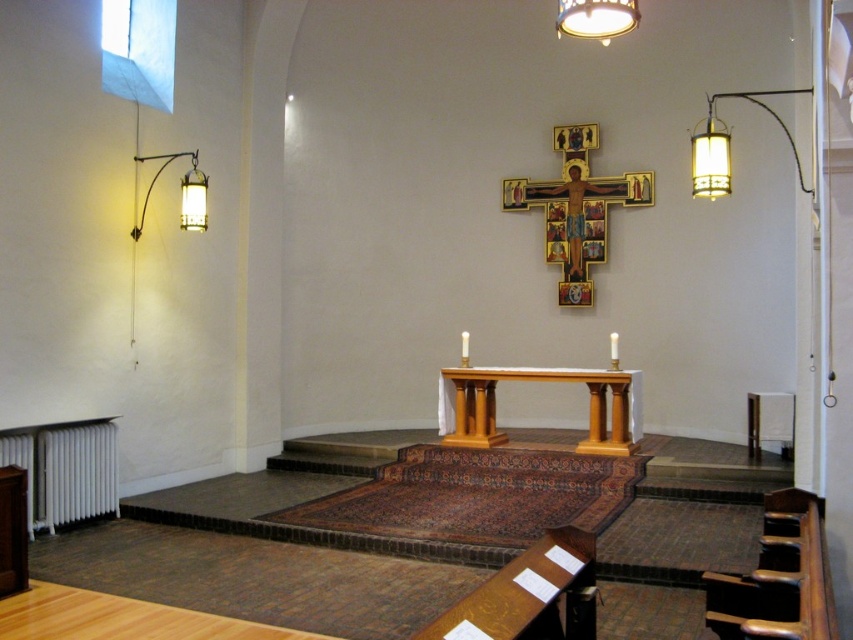
Does wooden altar at center have a greater height compared to white ceramic lamp at upper right?

Correct, wooden altar at center is much taller as white ceramic lamp at upper right.

Can you confirm if wooden altar at center is positioned to the left of white ceramic lamp at upper right?

Yes, wooden altar at center is to the left of white ceramic lamp at upper right.

Which is behind, point (442, 372) or point (793, 93)?

The point (442, 372) is more distant.

You are a GUI agent. You are given a task and a screenshot of the screen. Output one action in this format:
    pyautogui.click(x=<x>, y=<y>)
    Task: Click on the wooden altar at center
    The width and height of the screenshot is (853, 640).
    Given the screenshot: What is the action you would take?
    pyautogui.click(x=540, y=380)

Consider the image. Between wooden altar at center and metallic wall-mounted light fixture at left, which one appears on the right side from the viewer's perspective?

Positioned to the right is wooden altar at center.

Can you confirm if wooden altar at center is positioned to the right of metallic wall-mounted light fixture at left?

Yes, wooden altar at center is to the right of metallic wall-mounted light fixture at left.

Identify the location of wooden altar at center. Image resolution: width=853 pixels, height=640 pixels. (540, 380).

Where is `wooden altar at center`? Image resolution: width=853 pixels, height=640 pixels. wooden altar at center is located at coordinates (540, 380).

From the picture: Which is more to the right, matte white lampshade at upper center or metallic wall-mounted light fixture at left?

Positioned to the right is matte white lampshade at upper center.

Is matte white lampshade at upper center to the right of metallic wall-mounted light fixture at left from the viewer's perspective?

Yes, matte white lampshade at upper center is to the right of metallic wall-mounted light fixture at left.

Is point (564, 20) farther from viewer compared to point (193, 224)?

No, (564, 20) is closer to viewer.

Image resolution: width=853 pixels, height=640 pixels. What are the coordinates of `matte white lampshade at upper center` in the screenshot? It's located at (596, 19).